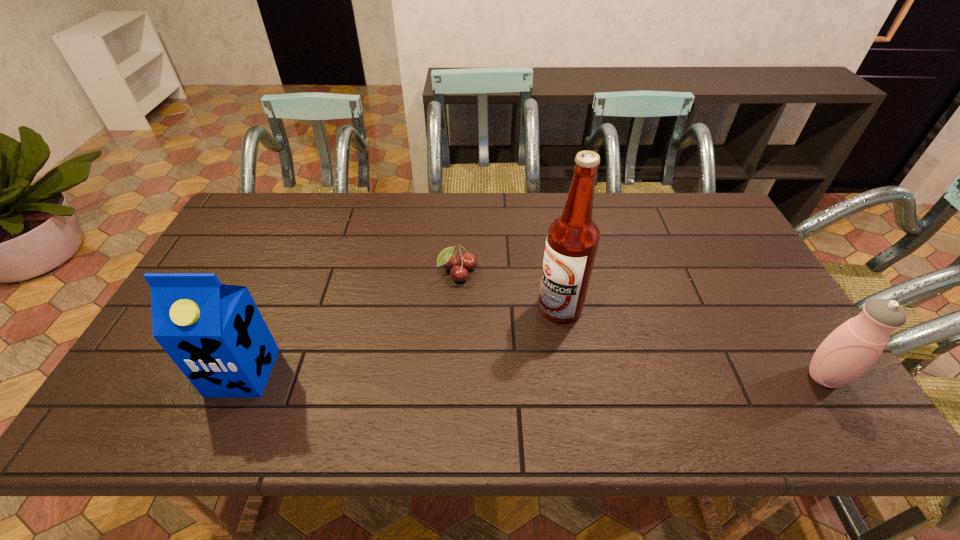
This screenshot has width=960, height=540. I want to click on vacant area at the near edge of the desktop, so click(617, 378).

Find the location of a particular element. vacant space at the left edge of the desktop is located at coordinates (250, 283).

You are a GUI agent. You are given a task and a screenshot of the screen. Output one action in this format:
    pyautogui.click(x=<x>, y=<y>)
    Task: Click on the blank area at the far left corner
    
    Given the screenshot: What is the action you would take?
    pyautogui.click(x=251, y=194)

Identify the location of free region at the far right corner. Image resolution: width=960 pixels, height=540 pixels. (698, 202).

The height and width of the screenshot is (540, 960). I want to click on vacant space that's between the leftmost object and the tallest object, so tap(401, 340).

At what (x,y) coordinates should I click in order to perform the action: click on vacant space that is in between the leftmost object and the farthest object. Please return your answer as a coordinate pair (x, y). This screenshot has height=540, width=960. Looking at the image, I should click on (350, 323).

Locate an element on the screen. The image size is (960, 540). vacant region between the second shortest object and the alcohol is located at coordinates (692, 342).

Identify the location of free space between the farthest object and the third object from left to right. (509, 291).

This screenshot has width=960, height=540. Identify the location of free space that is in between the second shortest object and the carton. (534, 375).

Identify the location of free space between the tallest object and the cherry. This screenshot has height=540, width=960. (509, 291).